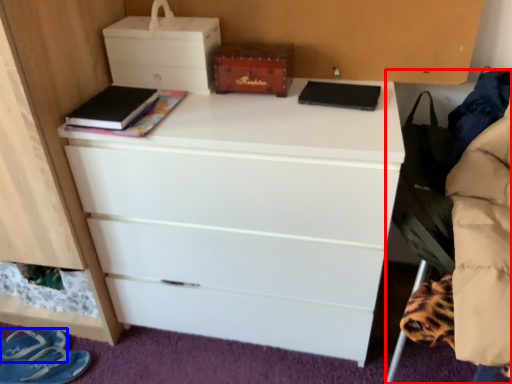
Question: Which of the following is the farthest to the observer, swivel chair (highlighted by a red box) or footwear (highlighted by a blue box)?

Choices:
 (A) swivel chair
 (B) footwear

Answer: (B)